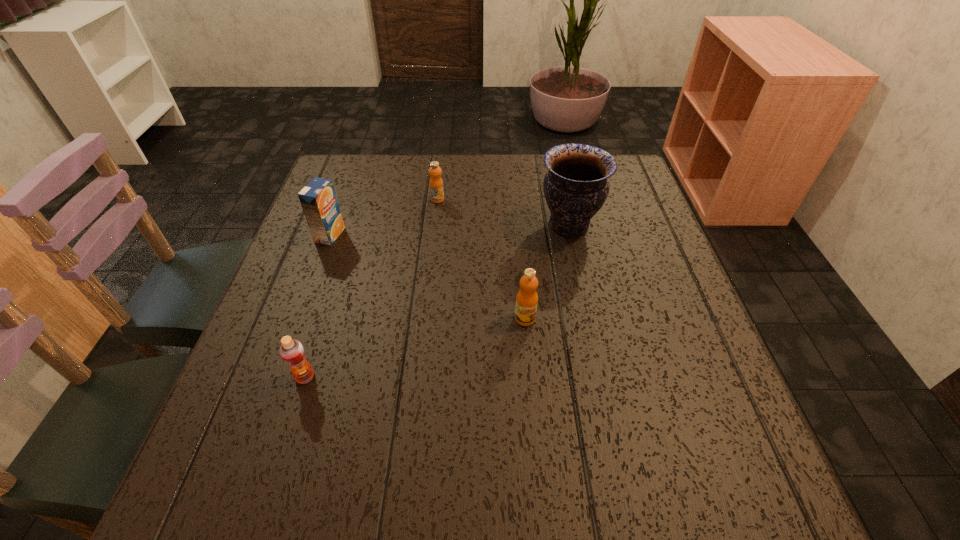
Find the location of a particular element. The image size is (960, 540). vacant space situated on the front handle of the pottery is located at coordinates (392, 225).

Image resolution: width=960 pixels, height=540 pixels. In order to click on vacant area located on the back of the third nearest orange juice in this screenshot , I will do `click(339, 210)`.

Identify the location of blank area located 0.300m on the front label of the second object from right to left. (540, 480).

Where is `vacant region located on the front of the nearest orange juice`? The image size is (960, 540). vacant region located on the front of the nearest orange juice is located at coordinates (287, 434).

Where is `vacant space situated on the front label of the farthest orange juice`? vacant space situated on the front label of the farthest orange juice is located at coordinates (429, 279).

The width and height of the screenshot is (960, 540). What are the coordinates of `object that is at the far edge` in the screenshot? It's located at (436, 184).

Image resolution: width=960 pixels, height=540 pixels. Identify the location of object situated at the right edge. (576, 186).

You are a GUI agent. You are given a task and a screenshot of the screen. Output one action in this format:
    pyautogui.click(x=<x>, y=<y>)
    Task: Click on the free space at the far edge of the desktop
    The height and width of the screenshot is (540, 960).
    Given the screenshot: What is the action you would take?
    pyautogui.click(x=472, y=168)

This screenshot has height=540, width=960. Find the location of `vacant space at the near edge of the desktop`. vacant space at the near edge of the desktop is located at coordinates (601, 472).

This screenshot has height=540, width=960. In the image, there is a desktop. In order to click on vacant space at the left edge in this screenshot , I will do `click(280, 357)`.